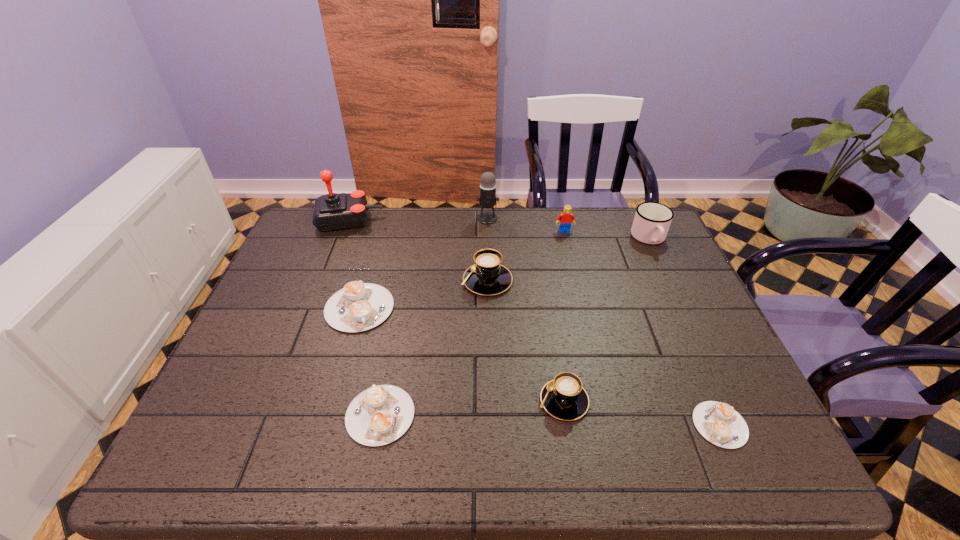
You are a GUI agent. You are given a task and a screenshot of the screen. Output one action in this format:
    pyautogui.click(x=<x>, y=<y>)
    Task: Click on the cappuccino that is at the right edge
    
    Given the screenshot: What is the action you would take?
    pyautogui.click(x=719, y=423)

Image resolution: width=960 pixels, height=540 pixels. Identify the location of object that is at the far left corner. (333, 211).

Where is `object present at the far right corner`? object present at the far right corner is located at coordinates (652, 220).

At what (x,y) coordinates should I click in order to perform the action: click on object located at the near right corner. Please return your answer as a coordinate pair (x, y). The image size is (960, 540). Looking at the image, I should click on click(x=719, y=423).

Locate an element on the screen. free space at the far edge of the desktop is located at coordinates (444, 234).

At what (x,y) coordinates should I click in order to perform the action: click on vacant space at the near edge of the desktop. Please return your answer as a coordinate pair (x, y). This screenshot has height=540, width=960. Looking at the image, I should click on (685, 457).

I want to click on vacant area at the left edge of the desktop, so click(236, 355).

Where is `vacant space at the right edge of the desktop`? vacant space at the right edge of the desktop is located at coordinates (682, 284).

I want to click on vacant area at the near left corner, so click(205, 465).

I want to click on vacant space at the far right corner, so click(654, 250).